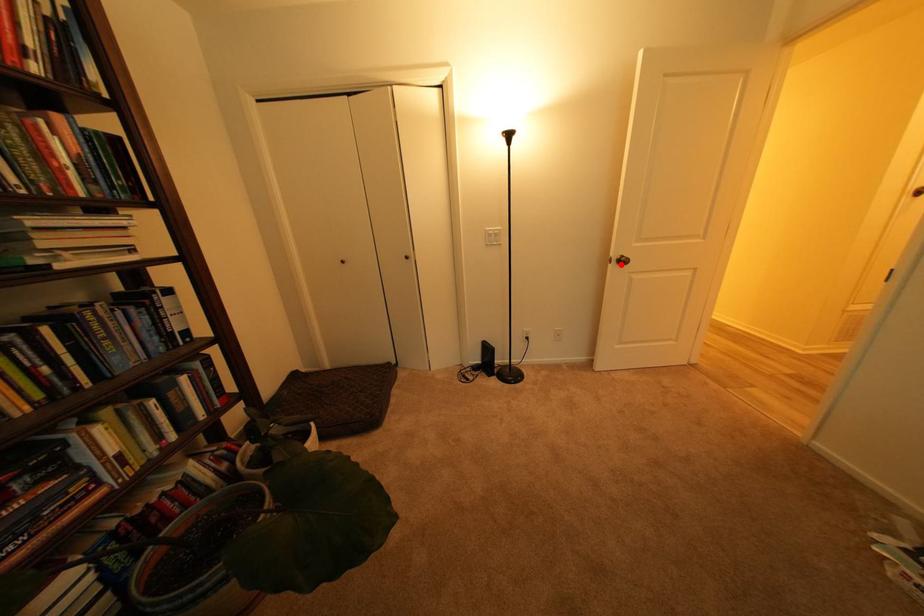
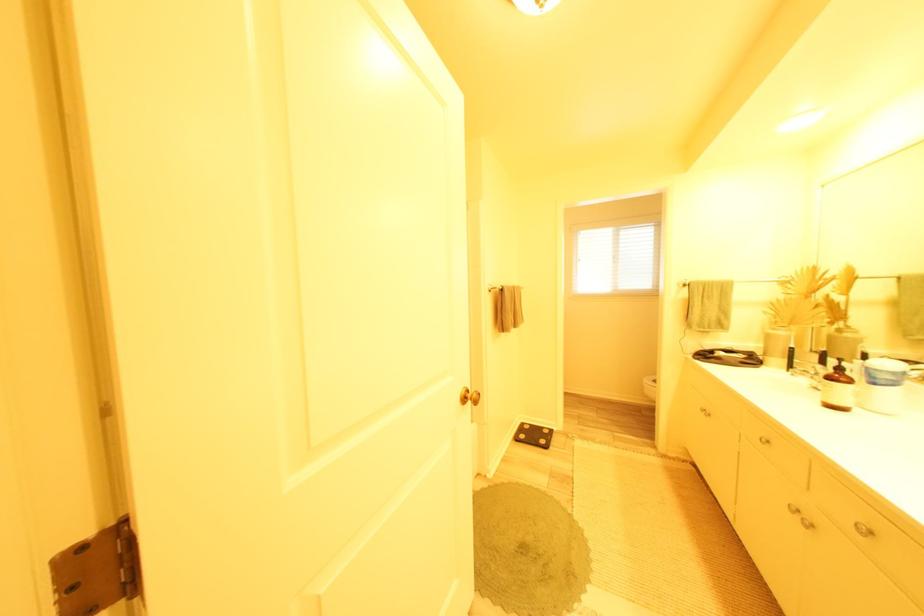
Question: I am providing you with two images of the same scene from different viewpoints. A red point is marked on the first image. Can you still see the location of the red point in image 2?

Choices:
 (A) Yes
 (B) No

Answer: (B)